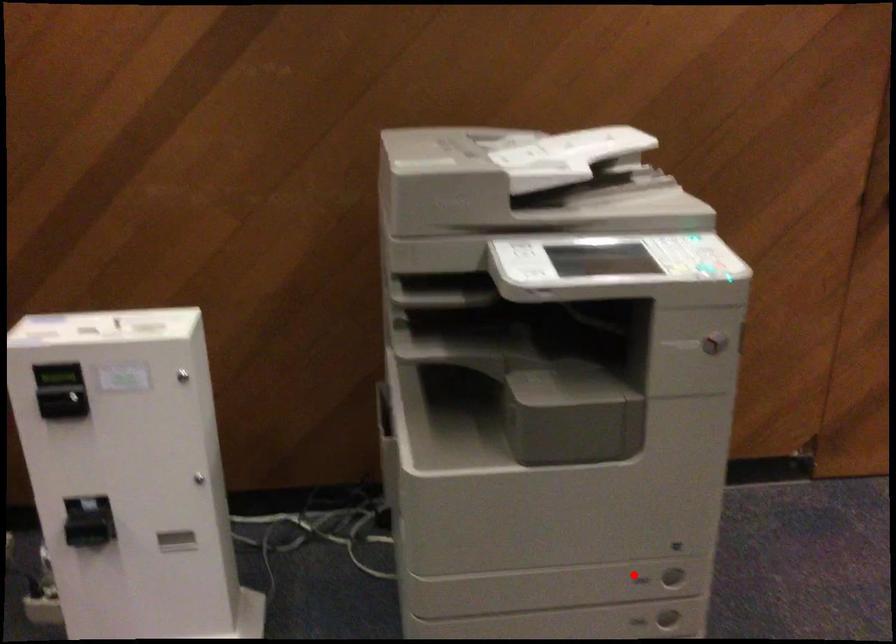
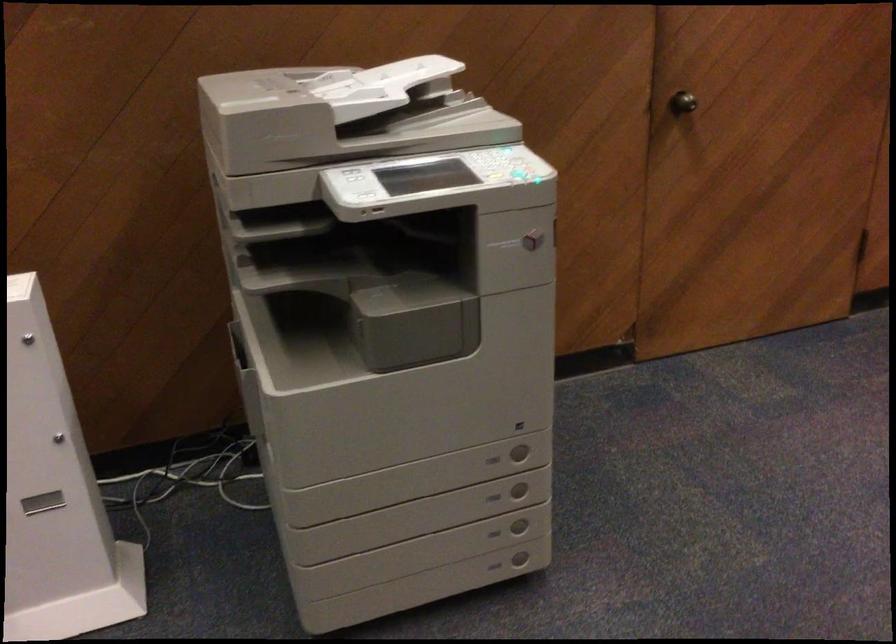
Question: I am providing you with two images of the same scene from different viewpoints. Given a red point in image1, look at the same physical point in image2. Is it:

Choices:
 (A) Closer to the viewpoint
 (B) Farther from the viewpoint

Answer: (B)